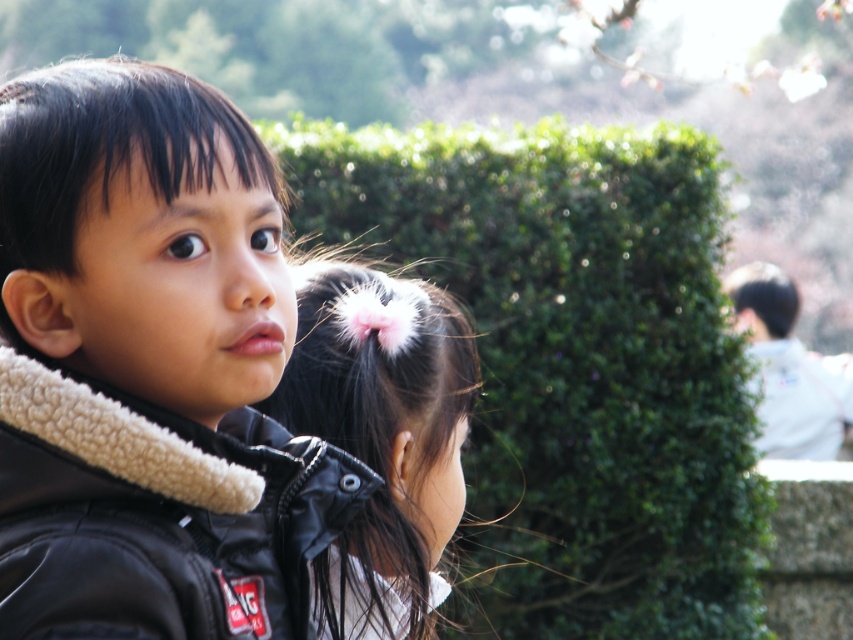
Is green leafy hedge at center below black fleece jacket at left?

No, green leafy hedge at center is not below black fleece jacket at left.

Looking at this image, can you confirm if green leafy hedge at center is taller than black fleece jacket at left?

Correct, green leafy hedge at center is much taller as black fleece jacket at left.

Does point (683, 140) come farther from viewer compared to point (216, 492)?

Yes, point (683, 140) is behind point (216, 492).

Find the location of a particular element. green leafy hedge at center is located at coordinates (572, 364).

Who is positioned more to the left, black fleece jacket at left or black matte jacket at center?

black fleece jacket at left

Measure the distance between point (245, 442) and camera.

A distance of 1.78 meters exists between point (245, 442) and camera.

This screenshot has height=640, width=853. What are the coordinates of `black fleece jacket at left` in the screenshot? It's located at (157, 515).

Between point (178, 609) and point (836, 362), which one is positioned in front?

Positioned in front is point (178, 609).

Between black fleece jacket at left and white cotton shirt at right, which one has more height?

With more height is white cotton shirt at right.

What do you see at coordinates (157, 515) in the screenshot? I see `black fleece jacket at left` at bounding box center [157, 515].

Identify the location of black fleece jacket at left. This screenshot has height=640, width=853. (157, 515).